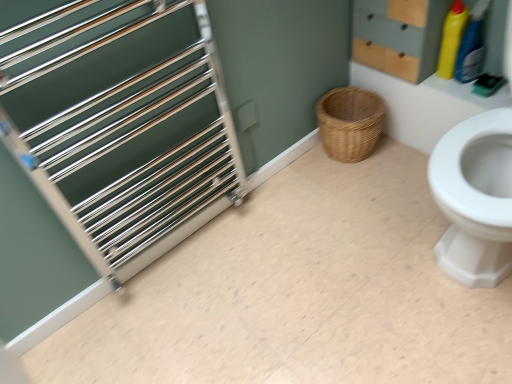
The width and height of the screenshot is (512, 384). Find the location of `vacant space in front of polished metal rack at left`. vacant space in front of polished metal rack at left is located at coordinates (209, 312).